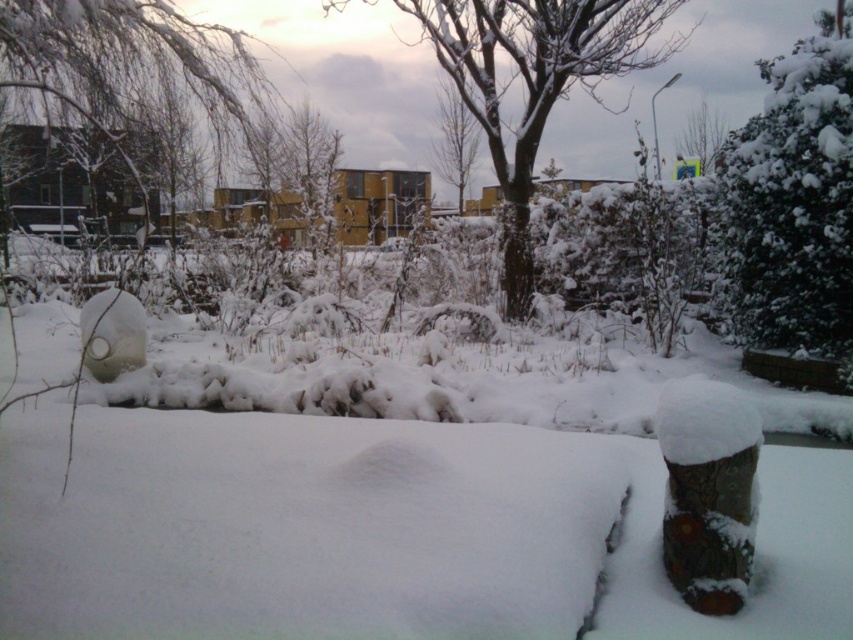
Can you confirm if white fluffy bush at upper right is bigger than snow-covered tree at center?

No, white fluffy bush at upper right is not bigger than snow-covered tree at center.

Does white fluffy bush at upper right have a greater width compared to snow-covered tree at center?

No, white fluffy bush at upper right is not wider than snow-covered tree at center.

I want to click on white fluffy bush at upper right, so click(x=791, y=202).

Is point (450, 147) farther from camera compared to point (689, 120)?

No, it is in front of (689, 120).

This screenshot has height=640, width=853. Describe the element at coordinates (454, 140) in the screenshot. I see `bare branches at center` at that location.

Is point (453, 144) in front of point (692, 145)?

Yes, point (453, 144) is closer to viewer.

You are a GUI agent. You are given a task and a screenshot of the screen. Output one action in this format:
    pyautogui.click(x=<x>, y=<y>)
    Task: Click on the bare branches at center
    The image size is (853, 640).
    Given the screenshot: What is the action you would take?
    pyautogui.click(x=454, y=140)

Which of these two, white fluffy bush at upper right or smooth bark tree at upper center, stands taller?

With more height is white fluffy bush at upper right.

Does white fluffy bush at upper right have a greater width compared to smooth bark tree at upper center?

Yes.

Between point (831, 113) and point (706, 156), which one is positioned in front?

Point (831, 113) is in front.

Locate an element on the screen. white fluffy bush at upper right is located at coordinates (791, 202).